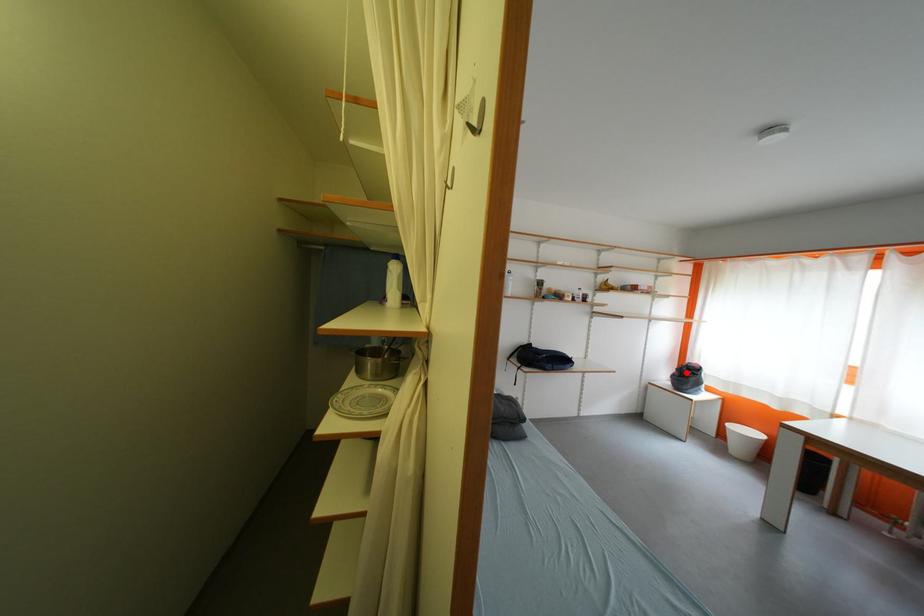
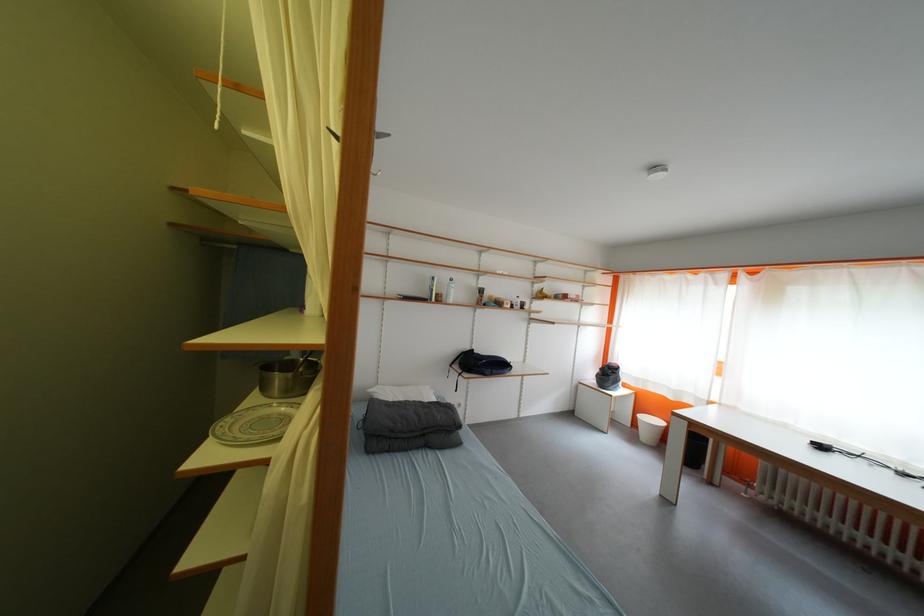
Question: I am providing you with two images of the same scene from different viewpoints. A red point is shown in image1. For the corresponding object point in image2, is it positioned nearer or farther from the camera?

Choices:
 (A) Nearer
 (B) Farther

Answer: (B)